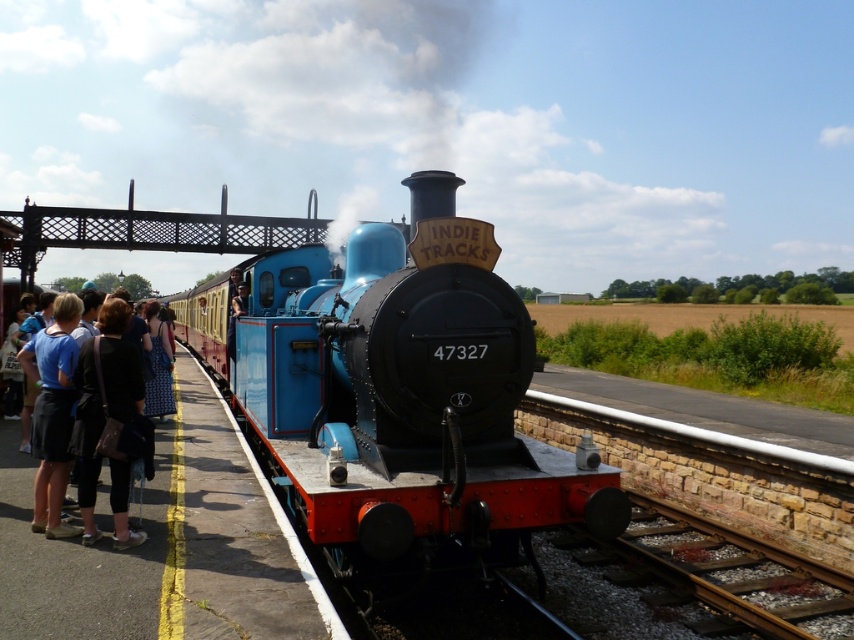
Does smoketransparentatupper center have a larger size compared to matte blue skirt at left?

Yes, smoketransparentatupper center is bigger than matte blue skirt at left.

Between smoketransparentatupper center and matte blue skirt at left, which one appears on the right side from the viewer's perspective?

smoketransparentatupper center

The height and width of the screenshot is (640, 854). Find the location of `smoketransparentatupper center`. smoketransparentatupper center is located at coordinates (389, 97).

Does smoketransparentatupper center come in front of black fabric bag at left?

No.

Between point (331, 100) and point (114, 408), which one is positioned behind?

The point (331, 100) is more distant.

Describe the element at coordinates (389, 97) in the screenshot. I see `smoketransparentatupper center` at that location.

I want to click on smoketransparentatupper center, so click(389, 97).

Is blue polished wood train at center wider than black fabric bag at left?

Correct, the width of blue polished wood train at center exceeds that of black fabric bag at left.

Between blue polished wood train at center and black fabric bag at left, which one is positioned higher?

Positioned higher is blue polished wood train at center.

Where is `blue polished wood train at center`? This screenshot has height=640, width=854. blue polished wood train at center is located at coordinates (401, 397).

Identify the location of blue polished wood train at center. Image resolution: width=854 pixels, height=640 pixels. (401, 397).